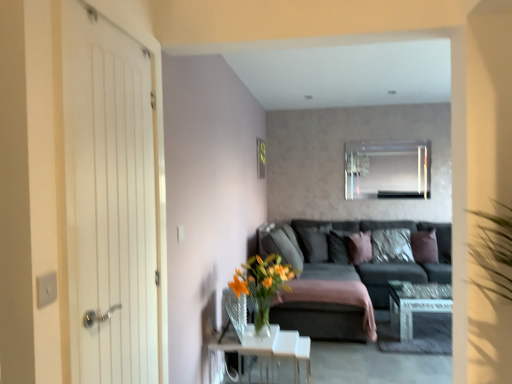
Question: In the image, is orange glass vase at center positioned in front of or behind clear glass mirror at upper center?

Choices:
 (A) front
 (B) behind

Answer: (A)

Question: Considering the positions of orange glass vase at center and clear glass mirror at upper center in the image, is orange glass vase at center wider or thinner than clear glass mirror at upper center?

Choices:
 (A) thin
 (B) wide

Answer: (B)

Question: Estimate the real-world distances between objects in this image. Which object is farther from the orange glass vase at center?

Choices:
 (A) clear glass table at lower center, which is the first table in front-to-back order
 (B) velvet brown pillow at center, the first pillow from the left
 (C) pink fabric pillow at center, placed as the third pillow when sorted from right to left
 (D) metallic gold picture frame at upper center
 (E) white wooden door at left

Answer: (D)

Question: Which object is positioned farthest from the clear glass mirror at upper center?

Choices:
 (A) white wooden door at left
 (B) orange glass vase at center
 (C) brown velvet pillow at right, the first pillow viewed from the right
 (D) velvet brown pillow at center, which appears as the fifth pillow when viewed from the right
 (E) textured gray pillow at center, acting as the 2th pillow starting from the right

Answer: (A)